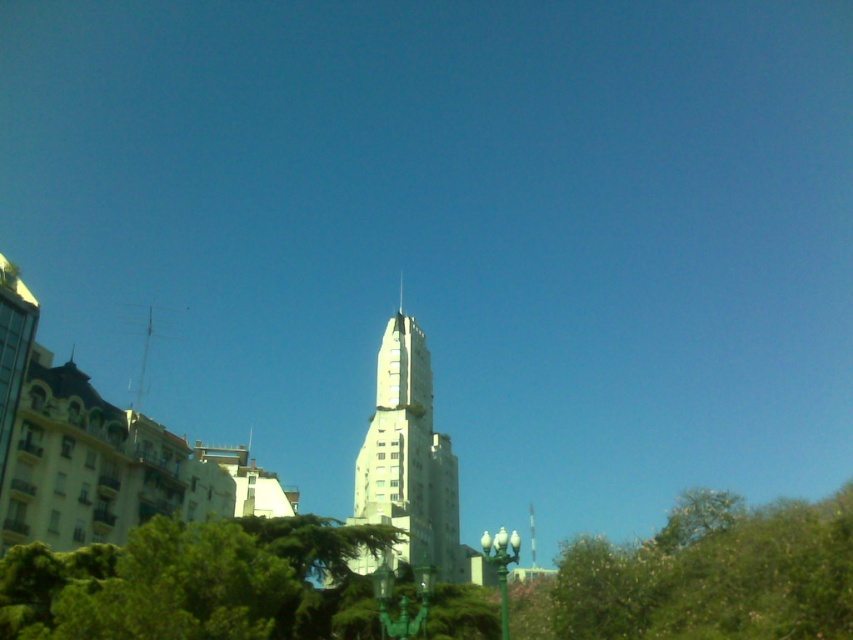
Question: Among these points, which one is nearest to the camera?

Choices:
 (A) (625, 625)
 (B) (438, 497)
 (C) (369, 612)
 (D) (672, 605)

Answer: (D)

Question: Does green leafy tree at lower left appear on the left side of green leafy tree at lower right?

Choices:
 (A) yes
 (B) no

Answer: (A)

Question: Can you confirm if green leafy tree at lower right is positioned above white stone spire at center?

Choices:
 (A) no
 (B) yes

Answer: (A)

Question: Which object is the farthest from the white stone spire at center?

Choices:
 (A) white smooth tower at center
 (B) green leafy tree at lower left

Answer: (B)

Question: Does green leafy tree at lower center have a smaller size compared to white smooth tower at center?

Choices:
 (A) no
 (B) yes

Answer: (B)

Question: Among these objects, which one is farthest from the camera?

Choices:
 (A) white stone spire at center
 (B) green leafy tree at lower left

Answer: (A)